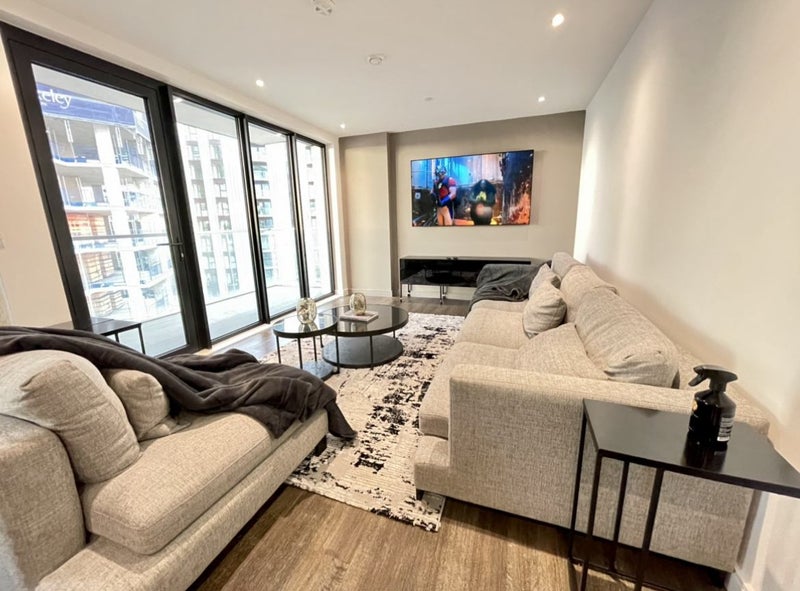
Locate an element on the screen. Image resolution: width=800 pixels, height=591 pixels. ceiling is located at coordinates (452, 64).